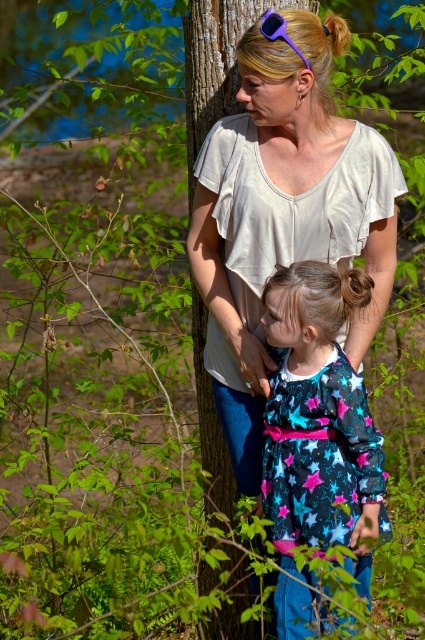
You are a photographer trying to capture a closeup of the woman and the girl in the scene. You notice two points marked at coordinates point (265, 8) and point (286, 36). Which point is closer to your camera lens?

Point (265, 8) is closer to the camera lens than point (286, 36) because it is further to the camera according to the description.

You are a hiker who needs to place a 3.5 feet long hiking pole between the smooth brown tree trunk at center and the purple plastic goggles at upper center. Can you fit the pole between them without bending it?

The smooth brown tree trunk at center is 4.71 feet away from the purple plastic goggles at upper center. Since the pole is 3.5 feet long, it can fit between them without bending because the distance is greater than the pole length.